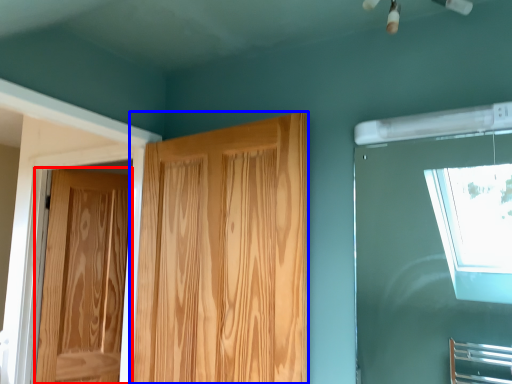
Question: Which of the following is the farthest to the observer, door (highlighted by a red box) or door (highlighted by a blue box)?

Choices:
 (A) door
 (B) door

Answer: (A)